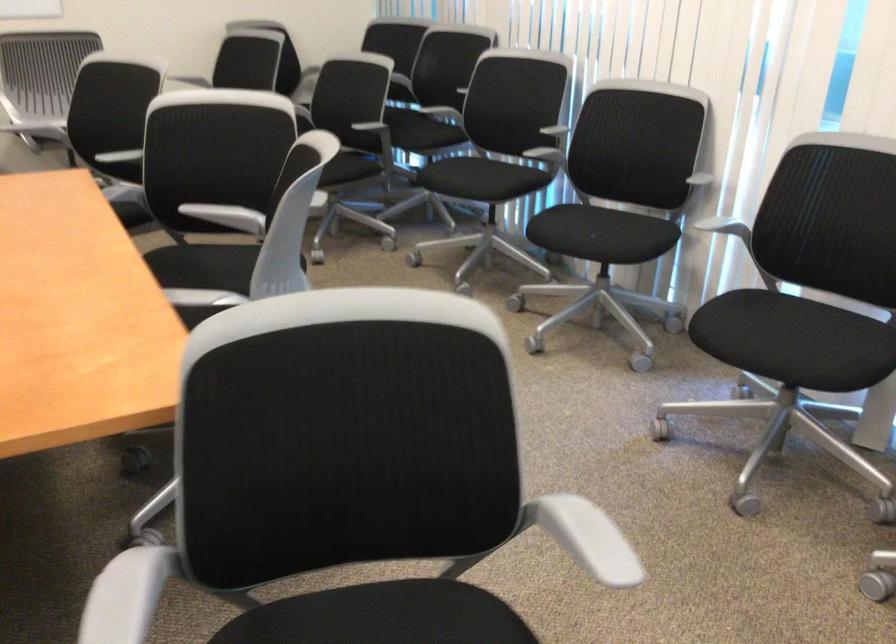
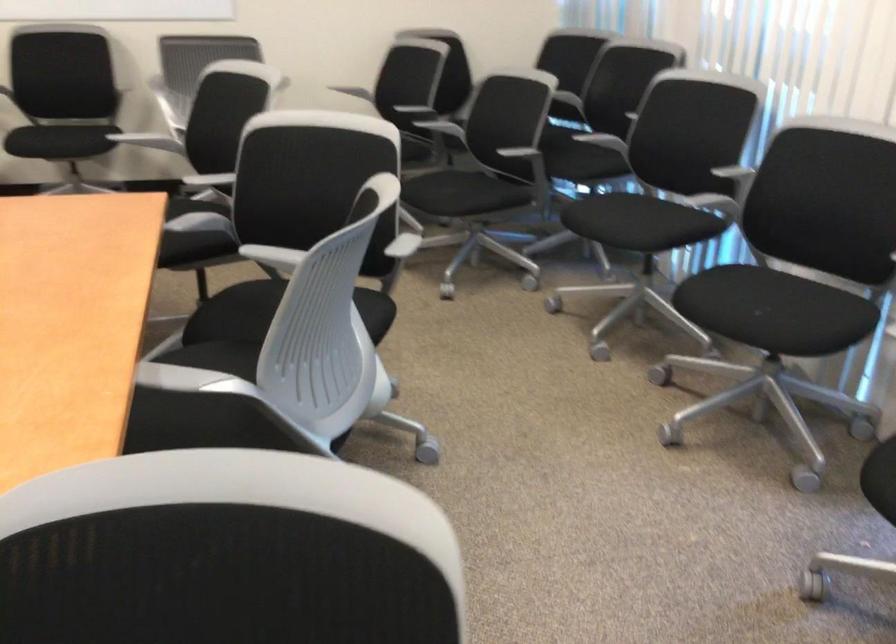
Where in the second image is the point corresponding to point 216,212 from the first image?

(273, 258)